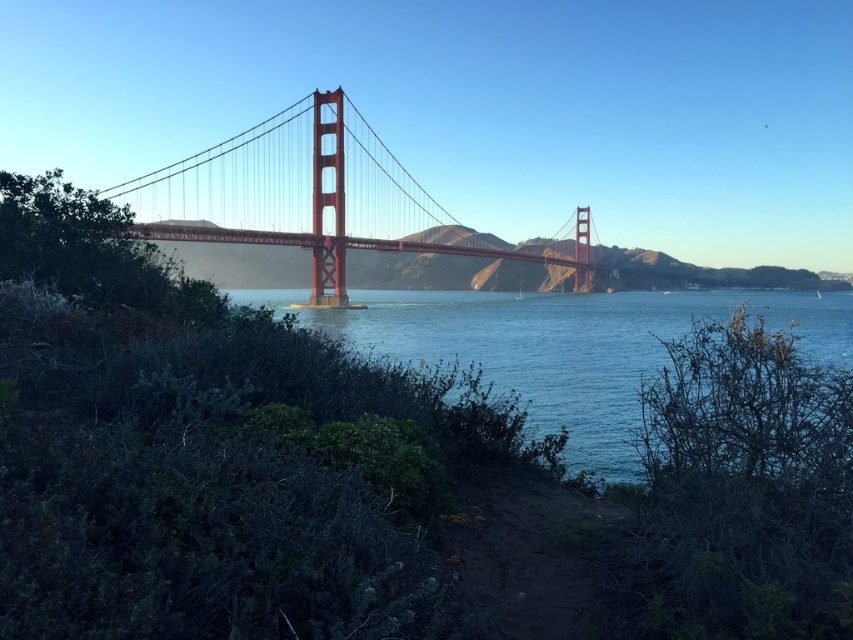
You are a photographer planning to capture the Golden Gate Bridge and the surrounding area. You want to ensure that the blue water at center and the metallic red suspension bridge at center are both visible in your shot. Based on their widths, which object should you prioritize framing first to ensure it fits within the composition?

The blue water at center is wider than the metallic red suspension bridge at center, so you should prioritize framing the blue water at center first to ensure it fits within the composition.

Where is the blue water at center located in the image?

The blue water at center is located at point coordinates of approximately 0.542 on the x axis and 0.665 on the y axis.